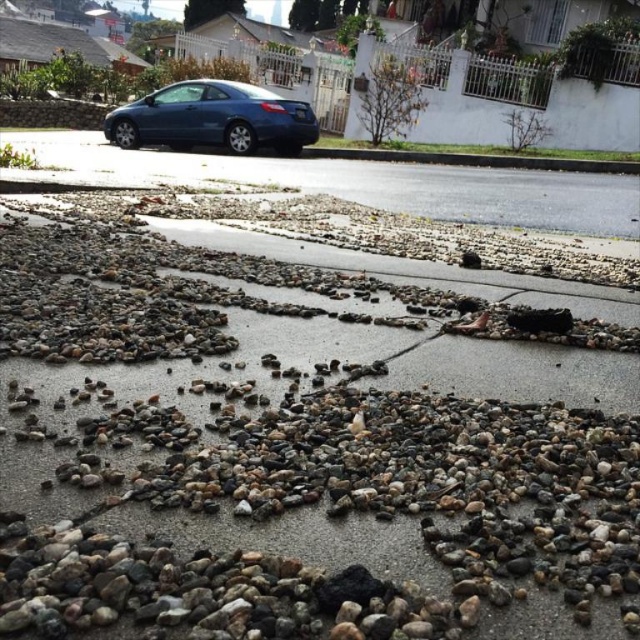
You are a delivery driver trying to navigate through the residential street. You see multicolored pebbles at center and a matte blue car at center. Which object takes up more space on the road?

The matte blue car at center takes up more space on the road than the multicolored pebbles at center, as the multicolored pebbles at center occupies less space than matte blue car at center.

You are standing on the residential street and see the gravel scattered everywhere. There is a point marked at coordinates (291,452). What object is located at that point?

The point at coordinates (291,452) corresponds to multicolored pebbles at center.